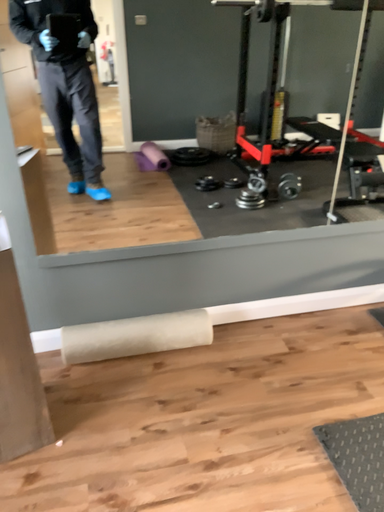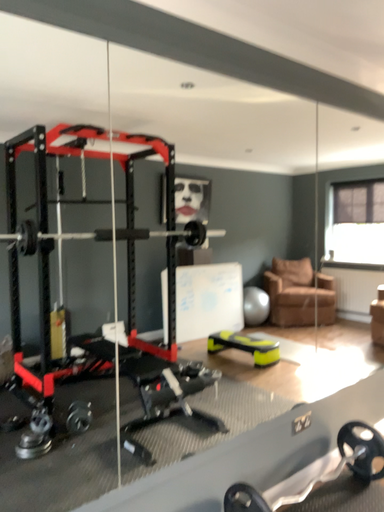
Question: Which way did the camera rotate in the video?

Choices:
 (A) rotated upward
 (B) rotated downward

Answer: (A)